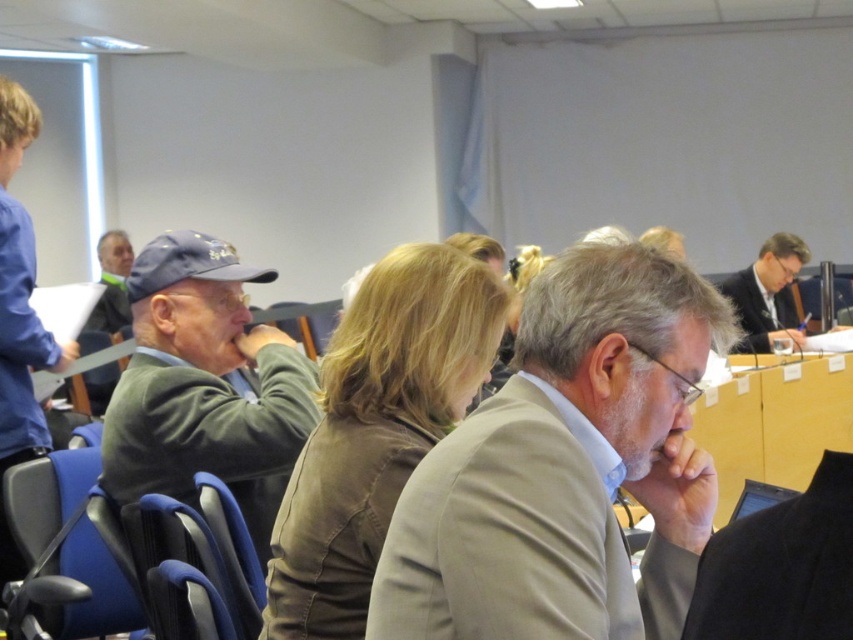
Question: Does light beige suit at center have a greater width compared to green wool sweater at left?

Choices:
 (A) yes
 (B) no

Answer: (B)

Question: Is light beige suit at center closer to camera compared to matte gray cap at upper left?

Choices:
 (A) no
 (B) yes

Answer: (B)

Question: Which point appears closest to the camera in this image?

Choices:
 (A) (100, 268)
 (B) (671, 481)
 (C) (764, 346)

Answer: (B)

Question: Which of the following is the closest to the observer?

Choices:
 (A) (618, 433)
 (B) (286, 387)

Answer: (A)

Question: Does dark suit at right lie behind matte gray cap at upper left?

Choices:
 (A) no
 (B) yes

Answer: (A)

Question: Which object is closer to the camera taking this photo?

Choices:
 (A) dark suit at right
 (B) matte gray cap at upper left
 (C) light beige suit at center

Answer: (C)